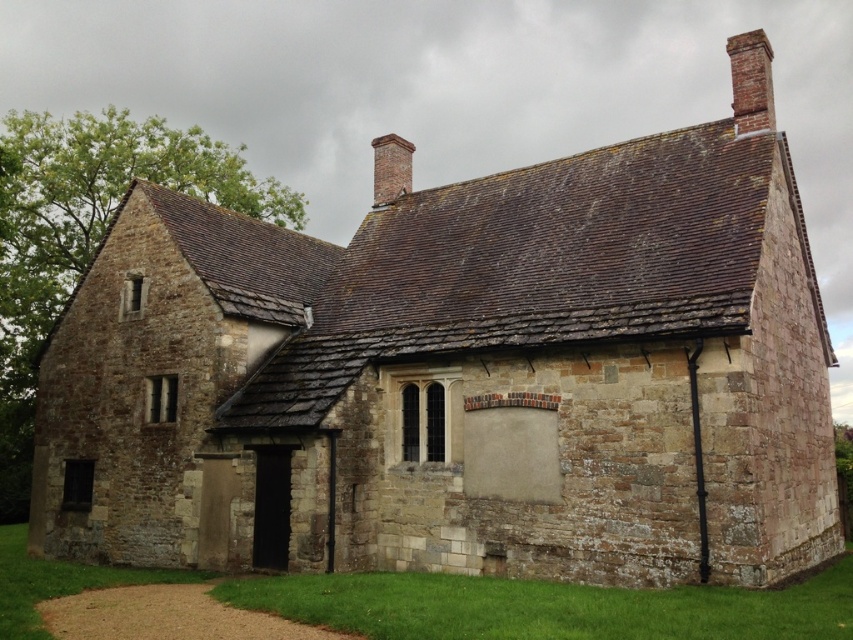
You are a maintenance worker assessing the building from the ground. You notice two brick chimneys on the roof. Which chimney, the brick chimney at upper right or the brick chimney at upper center, is physically closer to you?

The brick chimney at upper right is closer to the viewer than the brick chimney at upper center.